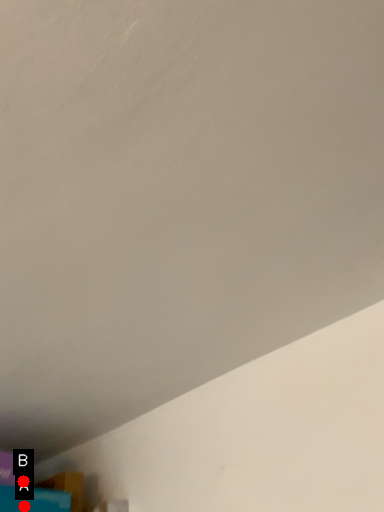
Question: Two points are circled on the image, labeled by A and B beside each circle. Which of the following is the closest to the observer?

Choices:
 (A) A is closer
 (B) B is closer

Answer: (A)